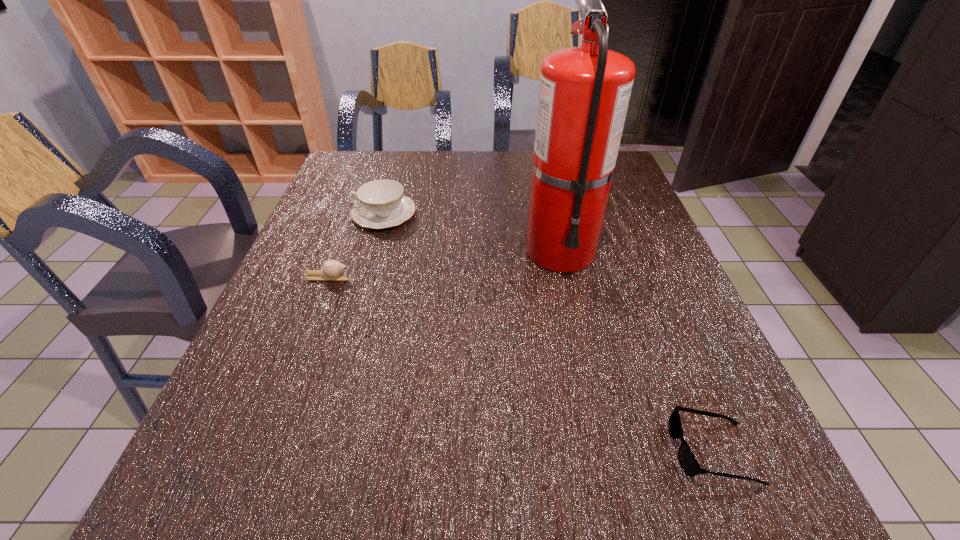
Locate an element on the screen. fire extinguisher is located at coordinates (584, 92).

Locate an element on the screen. The width and height of the screenshot is (960, 540). the third object from left to right is located at coordinates (584, 92).

Locate an element on the screen. The width and height of the screenshot is (960, 540). the second tallest object is located at coordinates (381, 204).

Image resolution: width=960 pixels, height=540 pixels. Identify the location of escargot. (331, 270).

This screenshot has width=960, height=540. I want to click on sunglasses, so click(x=687, y=460).

You are a GUI agent. You are given a task and a screenshot of the screen. Output one action in this format:
    pyautogui.click(x=<x>, y=<y>)
    Task: Click on the nearest object
    Image resolution: width=960 pixels, height=540 pixels.
    Given the screenshot: What is the action you would take?
    tap(687, 460)

This screenshot has height=540, width=960. Find the location of `vacant position located at the nozzle of the fire extinguisher`. vacant position located at the nozzle of the fire extinguisher is located at coordinates (587, 373).

What are the coordinates of `vacant region located 0.070m on the handle side of the second tallest object` in the screenshot? It's located at (325, 213).

Find the location of `free space located 0.060m on the handle side of the second tallest object`. free space located 0.060m on the handle side of the second tallest object is located at coordinates (329, 213).

Locate an element on the screen. This screenshot has height=540, width=960. free location located on the shell of the escargot is located at coordinates (425, 277).